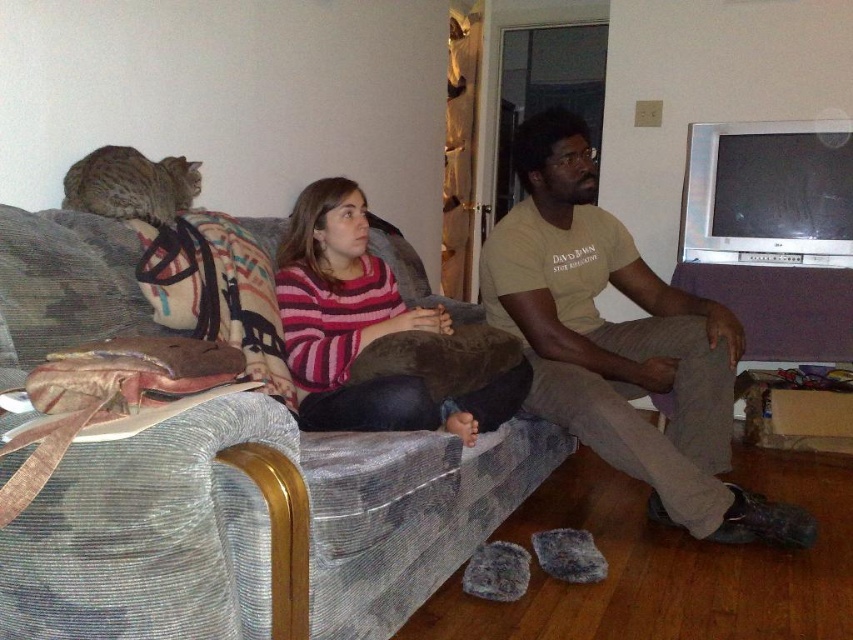
You are standing in the living room and want to place a small potted plant at point (613, 356). The plant requires at least 5 feet of space from the camera to ensure proper growth. Is the distance sufficient?

The distance of point (613, 356) from the camera is 6.81 feet, which is greater than the required 5 feet. Therefore, the distance is sufficient for the plant to grow properly.